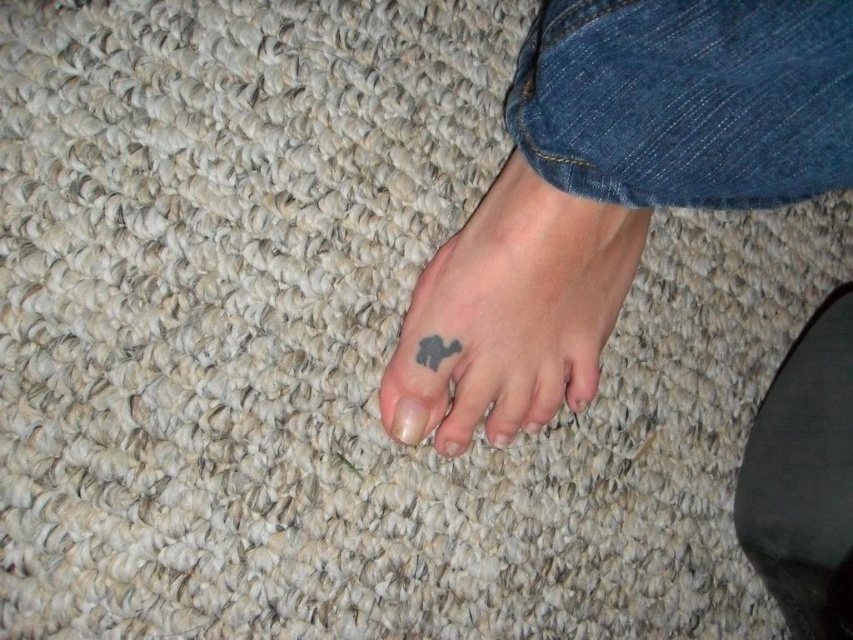
You are a tattoo artist examining the foot shown in the image. You need to place a new tattoo between the existing black matte tattoo at lower left and the black ink tattoo at lower center. Based on their positions, where should the new tattoo be placed?

The black matte tattoo at lower left is above the black ink tattoo at lower center, so the new tattoo should be placed between them, below the black matte tattoo at lower left and above the black ink tattoo at lower center.

You are a tattoo artist assessing the foot shown in the scene. You need to determine which tattoo requires more ink based on their sizes. Which tattoo between the black matte tattoo at lower left and the black ink tattoo at lower center would need more ink?

The black matte tattoo at lower left requires more ink because its width is larger than the black ink tattoo at lower center.

Looking at the foot in the image, where is the black ink tattoo at lower center positioned relative to the matte gray nail at center?

The black ink tattoo at lower center is positioned to the right of the matte gray nail at center.